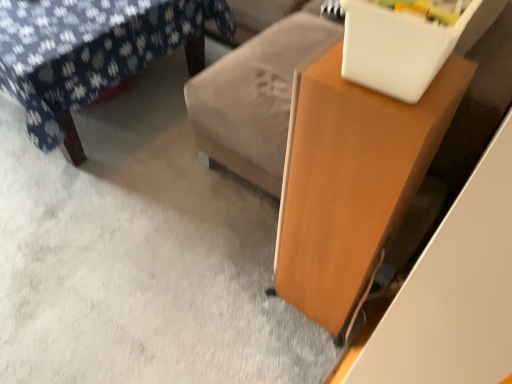
This screenshot has height=384, width=512. In order to click on velvet floral-patterned ottoman at upper left in this screenshot , I will do `click(91, 53)`.

What do you see at coordinates (91, 53) in the screenshot? The width and height of the screenshot is (512, 384). I see `velvet floral-patterned ottoman at upper left` at bounding box center [91, 53].

At what (x,y) coordinates should I click in order to perform the action: click on wooden table at right. Please return your answer as a coordinate pair (x, y). Image resolution: width=512 pixels, height=384 pixels. Looking at the image, I should click on (351, 181).

Image resolution: width=512 pixels, height=384 pixels. What do you see at coordinates (351, 181) in the screenshot? I see `wooden table at right` at bounding box center [351, 181].

This screenshot has height=384, width=512. Identify the location of velvet floral-patterned ottoman at upper left. (91, 53).

Which is more to the right, wooden table at right or velvet floral-patterned ottoman at upper left?

wooden table at right is more to the right.

Relative to velvet floral-patterned ottoman at upper left, is wooden table at right in front or behind?

Visually, wooden table at right is located in front of velvet floral-patterned ottoman at upper left.

Between point (323, 179) and point (62, 115), which one is positioned in front?

Positioned in front is point (323, 179).

In the scene shown: From the image's perspective, between wooden table at right and velvet floral-patterned ottoman at upper left, who is located below?

wooden table at right, from the image's perspective.

From a real-world perspective, is wooden table at right positioned above or below velvet floral-patterned ottoman at upper left?

In terms of real-world spatial position, wooden table at right is above velvet floral-patterned ottoman at upper left.

Which object is thinner, wooden table at right or velvet floral-patterned ottoman at upper left?

wooden table at right is thinner.

Who is taller, wooden table at right or velvet floral-patterned ottoman at upper left?

Standing taller between the two is wooden table at right.

Is wooden table at right smaller than velvet floral-patterned ottoman at upper left?

Correct, wooden table at right occupies less space than velvet floral-patterned ottoman at upper left.

Looking at this image, is wooden table at right situated inside velvet floral-patterned ottoman at upper left or outside?

wooden table at right cannot be found inside velvet floral-patterned ottoman at upper left.

Consider the image. Are wooden table at right and velvet floral-patterned ottoman at upper left making contact?

They are not placed beside each other.

Is wooden table at right oriented away from velvet floral-patterned ottoman at upper left?

No, velvet floral-patterned ottoman at upper left is not at the back of wooden table at right.

How different are the orientations of wooden table at right and velvet floral-patterned ottoman at upper left in degrees?

90 degrees.

The image size is (512, 384). I want to click on furniture on the left of wooden table at right, so click(x=91, y=53).

Based on their positions, is velvet floral-patterned ottoman at upper left located to the left or right of wooden table at right?

Based on their positions, velvet floral-patterned ottoman at upper left is located to the left of wooden table at right.

Relative to wooden table at right, is velvet floral-patterned ottoman at upper left in front or behind?

Clearly, velvet floral-patterned ottoman at upper left is behind wooden table at right.

Does point (105, 55) lie behind point (317, 207)?

Yes, it is behind point (317, 207).

From the image's perspective, is velvet floral-patterned ottoman at upper left located beneath wooden table at right?

Actually, velvet floral-patterned ottoman at upper left appears above wooden table at right in the image.

From a real-world perspective, is velvet floral-patterned ottoman at upper left beneath wooden table at right?

Yes, from a real-world perspective, velvet floral-patterned ottoman at upper left is below wooden table at right.

Considering the sizes of objects velvet floral-patterned ottoman at upper left and wooden table at right in the image provided, who is wider, velvet floral-patterned ottoman at upper left or wooden table at right?

With larger width is velvet floral-patterned ottoman at upper left.

Considering the relative sizes of velvet floral-patterned ottoman at upper left and wooden table at right in the image provided, is velvet floral-patterned ottoman at upper left taller than wooden table at right?

Incorrect, the height of velvet floral-patterned ottoman at upper left is not larger of that of wooden table at right.

Which of these two, velvet floral-patterned ottoman at upper left or wooden table at right, is bigger?

Bigger between the two is velvet floral-patterned ottoman at upper left.

Is velvet floral-patterned ottoman at upper left not inside wooden table at right?

velvet floral-patterned ottoman at upper left lies outside wooden table at right's area.

Is velvet floral-patterned ottoman at upper left in contact with wooden table at right?

No, velvet floral-patterned ottoman at upper left is not in contact with wooden table at right.

Does velvet floral-patterned ottoman at upper left turn towards wooden table at right?

No, velvet floral-patterned ottoman at upper left is not aimed at wooden table at right.

How many degrees apart are the facing directions of velvet floral-patterned ottoman at upper left and wooden table at right?

The angle between the facing direction of velvet floral-patterned ottoman at upper left and the facing direction of wooden table at right is 90 degrees.

How much distance is there between velvet floral-patterned ottoman at upper left and wooden table at right?

A distance of 3.61 feet exists between velvet floral-patterned ottoman at upper left and wooden table at right.

This screenshot has height=384, width=512. Identify the location of furniture on the left of the wooden table at right. (91, 53).

Locate an element on the screen. The height and width of the screenshot is (384, 512). furniture directly beneath the wooden table at right (from a real-world perspective) is located at coordinates (91, 53).

Identify the location of table lying in front of the velvet floral-patterned ottoman at upper left. This screenshot has height=384, width=512. (351, 181).